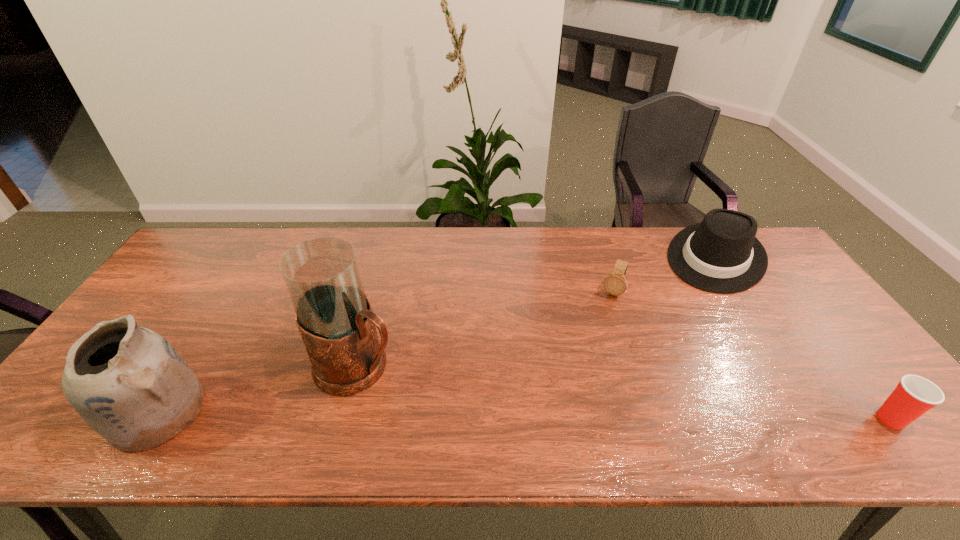
The width and height of the screenshot is (960, 540). I want to click on free space between the pottery and the Dixie cup, so click(x=524, y=416).

At what (x,y) coordinates should I click in order to perform the action: click on vacant area that lies between the Dixie cup and the third object from right to left. Please return your answer as a coordinate pair (x, y). The height and width of the screenshot is (540, 960). Looking at the image, I should click on (752, 356).

Find the location of a particular element. Image resolution: width=960 pixels, height=540 pixels. object that is the second closest to the watch is located at coordinates (334, 316).

Point out which object is positioned as the third nearest to the Dixie cup. Please provide its 2D coordinates. Your answer should be formatted as a tuple, i.e. [(x, y)], where the tuple contains the x and y coordinates of a point satisfying the conditions above.

[(334, 316)]

The image size is (960, 540). What are the coordinates of `free space that satisfies the following two spatial constraints: 1. on the back side of the tallest object; 2. on the right side of the watch` in the screenshot? It's located at (377, 293).

This screenshot has width=960, height=540. I want to click on vacant space that satisfies the following two spatial constraints: 1. on the back side of the tallest object; 2. on the left side of the watch, so click(377, 293).